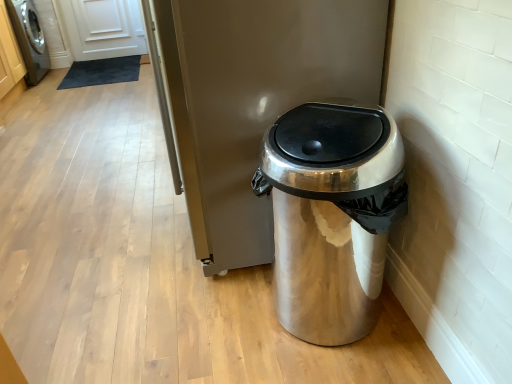
Where is `vacant space underneath shiny metallic trash can at lower right (from a real-world perspective)`? vacant space underneath shiny metallic trash can at lower right (from a real-world perspective) is located at coordinates (334, 321).